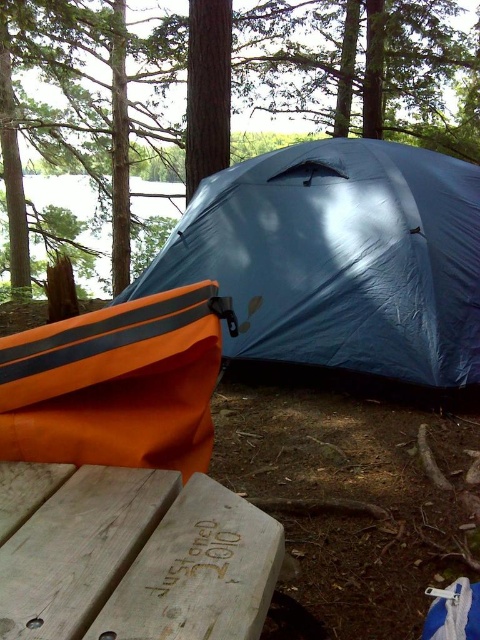
Question: Does blue tarpaulin tent at center lie behind transparent water at upper left?

Choices:
 (A) yes
 (B) no

Answer: (B)

Question: Does wooden picnic table at center come in front of transparent water at upper left?

Choices:
 (A) no
 (B) yes

Answer: (B)

Question: Which object is farther from the camera taking this photo?

Choices:
 (A) wooden picnic table at center
 (B) transparent water at upper left
 (C) blue tarpaulin tent at center
 (D) green matte tree at upper center

Answer: (D)

Question: Can you confirm if blue tarpaulin tent at center is positioned below wooden picnic table at center?

Choices:
 (A) no
 (B) yes

Answer: (A)

Question: Estimate the real-world distances between objects in this image. Which object is closer to the green matte tree at upper center?

Choices:
 (A) blue tarpaulin tent at center
 (B) transparent water at upper left
 (C) wooden picnic table at center

Answer: (B)

Question: Which object is closer to the camera taking this photo?

Choices:
 (A) green matte tree at upper center
 (B) wooden picnic table at center
 (C) blue tarpaulin tent at center

Answer: (B)